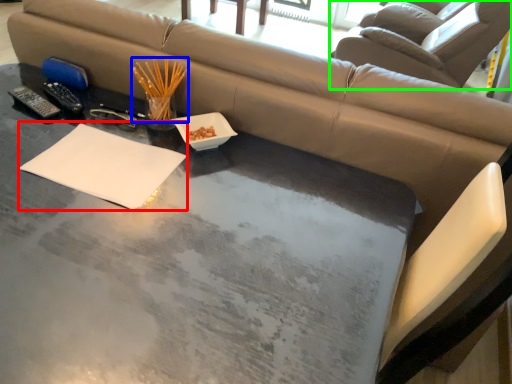
Question: Which object is the closest to the notepad (highlighted by a red box)? Choose among these: chopstick (highlighted by a blue box) or swivel chair (highlighted by a green box).

Choices:
 (A) chopstick
 (B) swivel chair

Answer: (A)